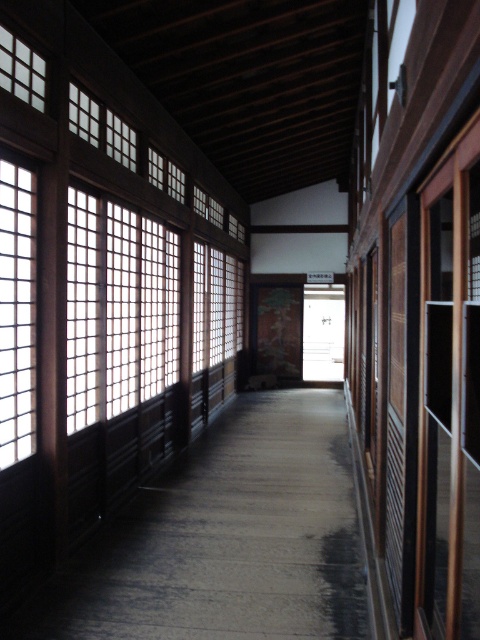
What do you see at coordinates (118, 308) in the screenshot? I see `white grid screen at center` at bounding box center [118, 308].

The width and height of the screenshot is (480, 640). What are the coordinates of `white grid screen at center` in the screenshot? It's located at (118, 308).

Which is more to the right, translucent wooden grid at upper left or translucent wooden lattice at upper left?

From the viewer's perspective, translucent wooden grid at upper left appears more on the right side.

Between point (93, 124) and point (33, 96), which one is positioned in front?

Point (33, 96) is in front.

You are a GUI agent. You are given a task and a screenshot of the screen. Output one action in this format:
    pyautogui.click(x=<x>, y=<y>)
    Task: Click on the translucent wooden grid at upper left
    The width and height of the screenshot is (480, 640).
    Given the screenshot: What is the action you would take?
    pyautogui.click(x=101, y=128)

Find the location of a particular element. Image resolution: width=480 pixels, height=640 pixels. translucent wooden grid at upper left is located at coordinates (101, 128).

Does wooden floor at center appear on the right side of white grid screen at center?

Correct, you'll find wooden floor at center to the right of white grid screen at center.

Which is more to the right, wooden floor at center or white grid screen at center?

wooden floor at center

Identify the location of wooden floor at center. This screenshot has height=640, width=480. (227, 538).